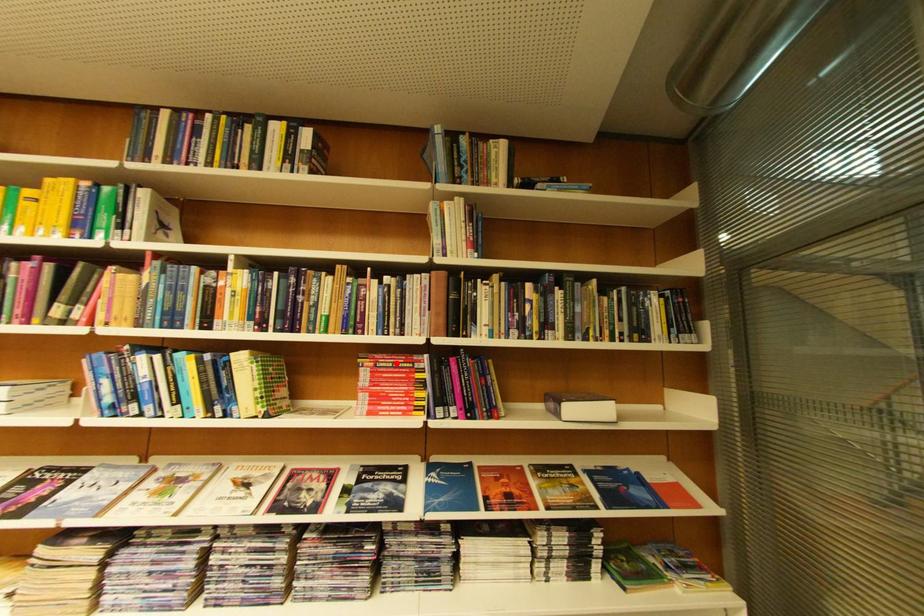
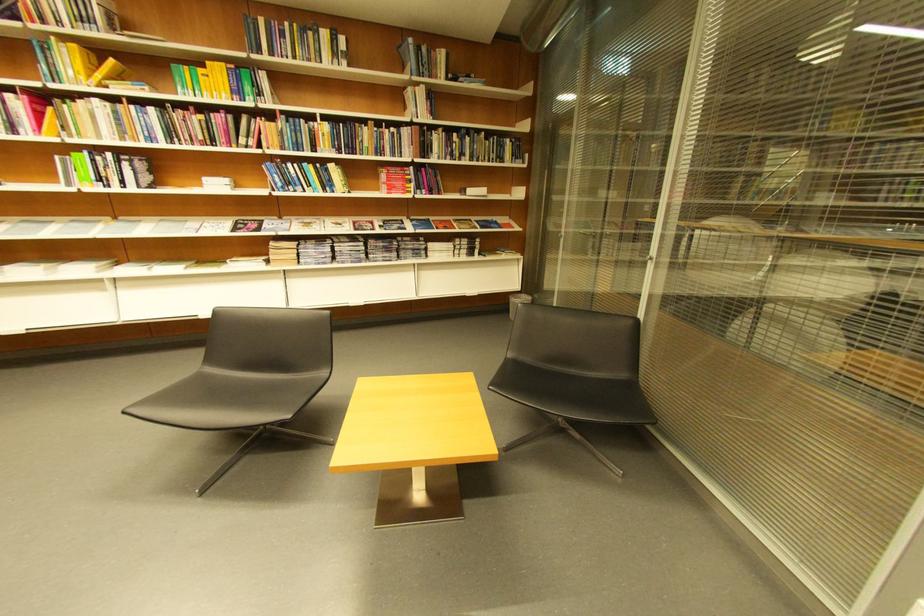
Find the pixel in the second image that matches the highlighted location in the first image.

(403, 172)